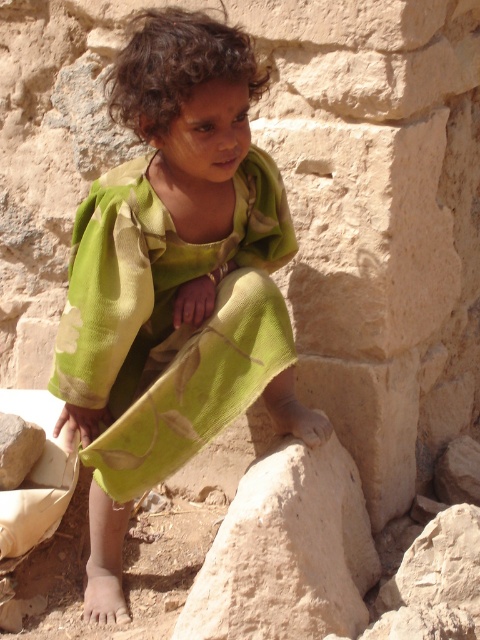
Does green fabric at center have a larger size compared to smooth beige rock at lower center?

Correct, green fabric at center is larger in size than smooth beige rock at lower center.

Does green fabric at center have a smaller size compared to smooth beige rock at lower center?

Actually, green fabric at center might be larger than smooth beige rock at lower center.

Does point (146, 227) lie in front of point (240, 637)?

No, it is not.

Identify the location of green fabric at center. (180, 244).